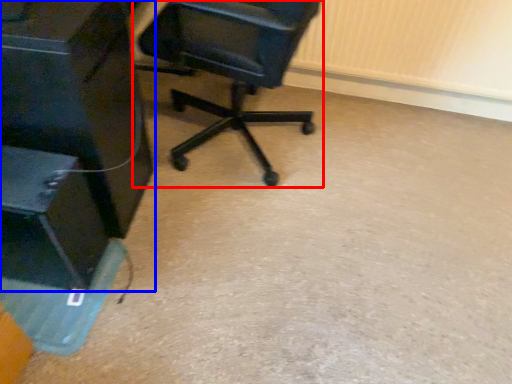
Question: Which of the following is the closest to the observer, chair (highlighted by a red box) or furniture (highlighted by a blue box)?

Choices:
 (A) chair
 (B) furniture

Answer: (B)